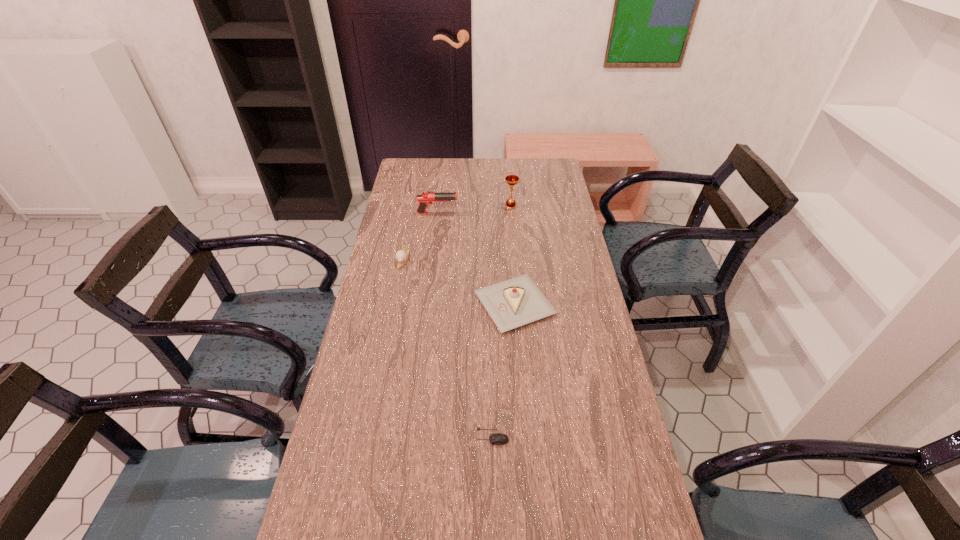
Find the location of a particular element. The width and height of the screenshot is (960, 540). free spot located on the back of the farthest object is located at coordinates (508, 171).

The image size is (960, 540). Identify the location of vacant space located 0.220m at the aiming end of the fourth nearest object. (510, 213).

Find the location of a particular element. The height and width of the screenshot is (540, 960). blank space located 0.400m on the front of the second nearest object is located at coordinates (527, 461).

This screenshot has height=540, width=960. Identify the location of vacant region located on the shell of the third farthest object. (393, 312).

Where is `blank space located 0.260m on the right of the mouse`? This screenshot has width=960, height=540. blank space located 0.260m on the right of the mouse is located at coordinates (609, 437).

At what (x,y) coordinates should I click in order to perform the action: click on gun at the left edge. Please return your answer as a coordinate pair (x, y). The height and width of the screenshot is (540, 960). Looking at the image, I should click on (425, 198).

Find the location of `escargot that is at the left edge`. escargot that is at the left edge is located at coordinates (401, 256).

You are a GUI agent. You are given a task and a screenshot of the screen. Output one action in this format:
    pyautogui.click(x=<x>, y=<y>)
    Task: Click on the object at the right edge
    The height and width of the screenshot is (540, 960).
    Given the screenshot: What is the action you would take?
    pyautogui.click(x=513, y=303)

I want to click on vacant area at the far edge, so [490, 168].

What are the coordinates of `vacant space at the left edge of the desktop` in the screenshot? It's located at pyautogui.click(x=332, y=424).